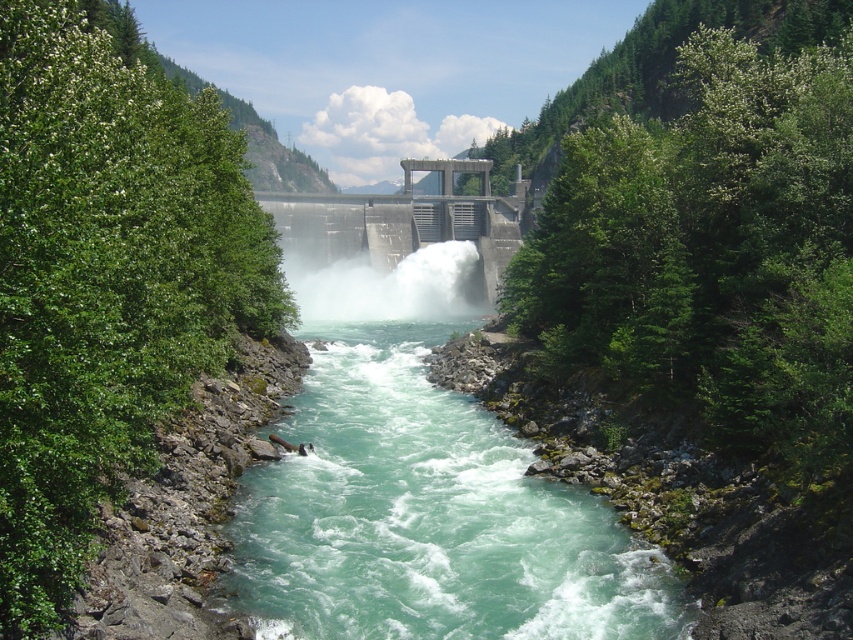
Question: Can you confirm if turquoise water at center is thinner than gray concrete dam at center?

Choices:
 (A) no
 (B) yes

Answer: (B)

Question: Which of these objects is positioned closest to the turquoise water at center?

Choices:
 (A) gray concrete dam at center
 (B) white frothy water at center

Answer: (B)

Question: Is turquoise water at center below white frothy water at center?

Choices:
 (A) no
 (B) yes

Answer: (B)

Question: Which of the following is the farthest from the observer?

Choices:
 (A) white frothy water at center
 (B) turquoise water at center

Answer: (A)

Question: Which point is closer to the camera taking this photo?

Choices:
 (A) (432, 576)
 (B) (448, 198)
 (C) (299, 298)

Answer: (A)

Question: Where is turquoise water at center located in relation to gray concrete dam at center in the image?

Choices:
 (A) right
 (B) left

Answer: (B)